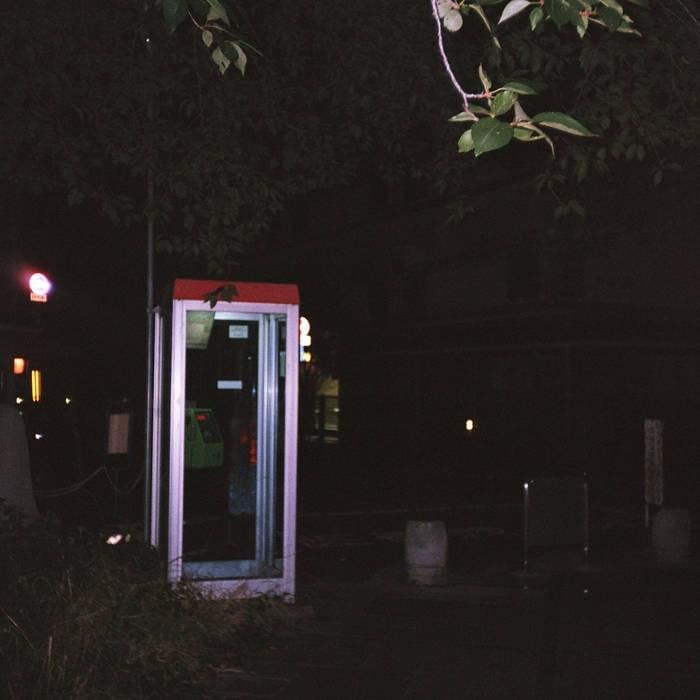
The width and height of the screenshot is (700, 700). I want to click on trash can, so pos(418,553).